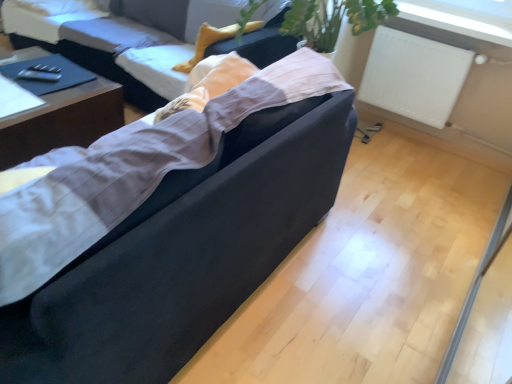
This screenshot has height=384, width=512. Identify the location of vacant space situated above white matte radiator at upper right (from a real-world perspective). (434, 35).